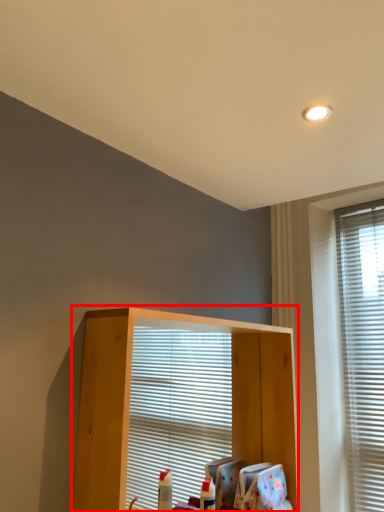
Question: From the image, what is the correct spatial relationship of shelf (annotated by the red box) in relation to window?

Choices:
 (A) right
 (B) left

Answer: (B)